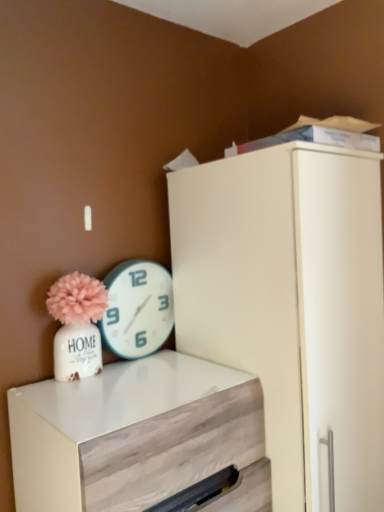
Question: Considering the relative sizes of white wood chest of drawers at lower left and teal plastic wall clock at upper center in the image provided, is white wood chest of drawers at lower left smaller than teal plastic wall clock at upper center?

Choices:
 (A) yes
 (B) no

Answer: (B)

Question: Could you tell me if white wood chest of drawers at lower left is facing teal plastic wall clock at upper center?

Choices:
 (A) no
 (B) yes

Answer: (A)

Question: Does white wood chest of drawers at lower left lie in front of teal plastic wall clock at upper center?

Choices:
 (A) no
 (B) yes

Answer: (B)

Question: Does white wood chest of drawers at lower left have a larger size compared to teal plastic wall clock at upper center?

Choices:
 (A) no
 (B) yes

Answer: (B)

Question: Is white wood chest of drawers at lower left touching teal plastic wall clock at upper center?

Choices:
 (A) yes
 (B) no

Answer: (B)

Question: Can you confirm if white wood chest of drawers at lower left is shorter than teal plastic wall clock at upper center?

Choices:
 (A) no
 (B) yes

Answer: (A)

Question: Is teal plastic wall clock at upper center taller than white wood chest of drawers at lower left?

Choices:
 (A) yes
 (B) no

Answer: (B)

Question: Does teal plastic wall clock at upper center come in front of white wood chest of drawers at lower left?

Choices:
 (A) no
 (B) yes

Answer: (A)

Question: Can you confirm if teal plastic wall clock at upper center is wider than white wood chest of drawers at lower left?

Choices:
 (A) no
 (B) yes

Answer: (A)

Question: Is white wood chest of drawers at lower left inside teal plastic wall clock at upper center?

Choices:
 (A) yes
 (B) no

Answer: (B)

Question: Considering the relative positions of teal plastic wall clock at upper center and white wood chest of drawers at lower left in the image provided, is teal plastic wall clock at upper center to the left of white wood chest of drawers at lower left from the viewer's perspective?

Choices:
 (A) yes
 (B) no

Answer: (A)

Question: From a real-world perspective, is teal plastic wall clock at upper center positioned under white wood chest of drawers at lower left based on gravity?

Choices:
 (A) yes
 (B) no

Answer: (B)

Question: In terms of height, does teal plastic wall clock at upper center look taller or shorter compared to white wood chest of drawers at lower left?

Choices:
 (A) short
 (B) tall

Answer: (A)